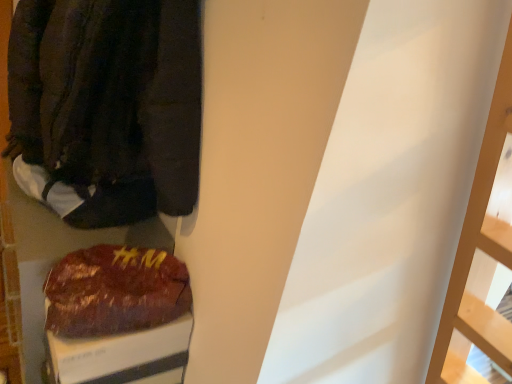
Question: From the image's perspective, is shiny brown bag at lower left beneath white fabric shoe at left?

Choices:
 (A) no
 (B) yes

Answer: (B)

Question: Does shiny brown bag at lower left appear on the left side of white fabric shoe at left?

Choices:
 (A) yes
 (B) no

Answer: (B)

Question: Is shiny brown bag at lower left positioned in front of white fabric shoe at left?

Choices:
 (A) no
 (B) yes

Answer: (B)

Question: Can you confirm if shiny brown bag at lower left is smaller than white fabric shoe at left?

Choices:
 (A) yes
 (B) no

Answer: (A)

Question: From the image's perspective, does shiny brown bag at lower left appear higher than white fabric shoe at left?

Choices:
 (A) yes
 (B) no

Answer: (B)

Question: From a real-world perspective, is white fabric shoe at left above or below dark brown fabric jacket at left?

Choices:
 (A) below
 (B) above

Answer: (A)

Question: Considering their positions, is white fabric shoe at left located in front of or behind dark brown fabric jacket at left?

Choices:
 (A) behind
 (B) front

Answer: (A)

Question: Do you think white fabric shoe at left is within dark brown fabric jacket at left, or outside of it?

Choices:
 (A) inside
 (B) outside

Answer: (B)

Question: In terms of height, does white fabric shoe at left look taller or shorter compared to dark brown fabric jacket at left?

Choices:
 (A) short
 (B) tall

Answer: (A)

Question: Is dark brown fabric jacket at left inside the boundaries of white fabric shoe at left, or outside?

Choices:
 (A) inside
 (B) outside

Answer: (B)

Question: From the image's perspective, is dark brown fabric jacket at left positioned above or below white fabric shoe at left?

Choices:
 (A) above
 (B) below

Answer: (A)

Question: In terms of width, does dark brown fabric jacket at left look wider or thinner when compared to white fabric shoe at left?

Choices:
 (A) thin
 (B) wide

Answer: (B)

Question: Is dark brown fabric jacket at left in front of or behind white fabric shoe at left in the image?

Choices:
 (A) front
 (B) behind

Answer: (A)

Question: Is dark brown fabric jacket at left wider or thinner than shiny brown bag at lower left?

Choices:
 (A) thin
 (B) wide

Answer: (B)

Question: Relative to shiny brown bag at lower left, is dark brown fabric jacket at left in front or behind?

Choices:
 (A) behind
 (B) front

Answer: (B)